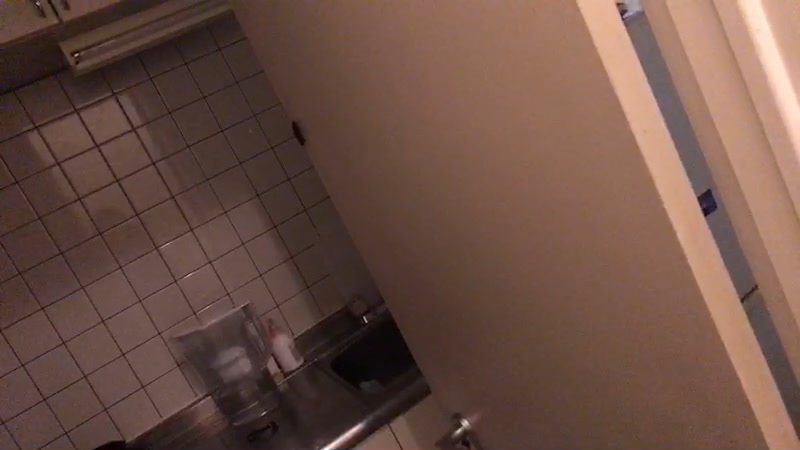
Identify the location of rows of tiles. This screenshot has width=800, height=450. (177, 405), (152, 366), (130, 333), (113, 300), (94, 272), (62, 236), (52, 200), (30, 167), (17, 122).